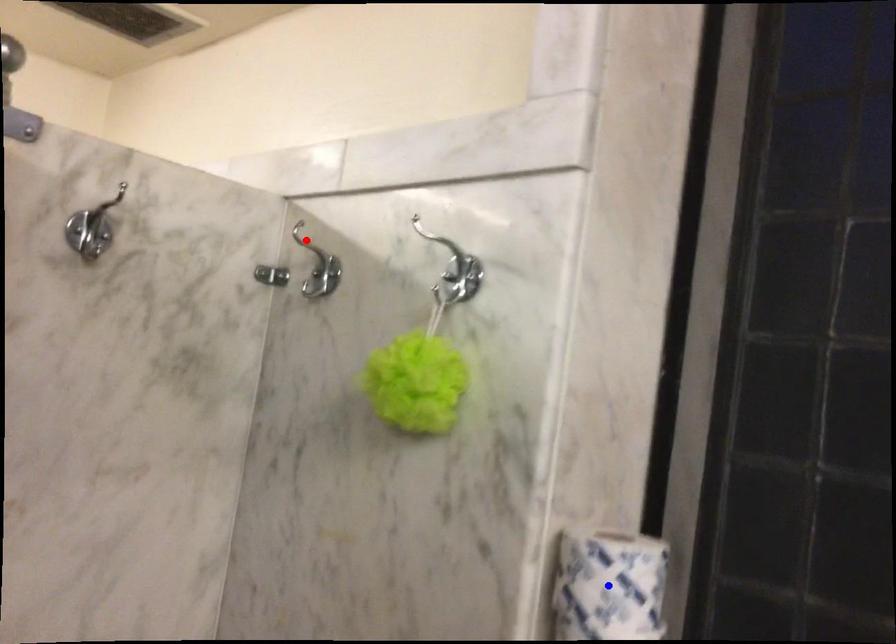
Question: In the image, two points are highlighted. Which point is nearer to the camera? Reply with the corresponding letter.

Choices:
 (A) blue point
 (B) red point

Answer: (A)